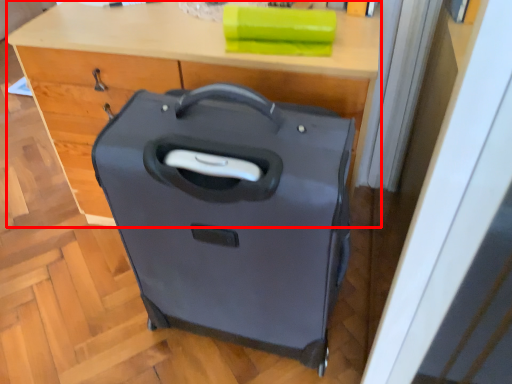
Question: From the image's perspective, where is computer desk (annotated by the red box) located in relation to suitcase in the image?

Choices:
 (A) below
 (B) above

Answer: (B)